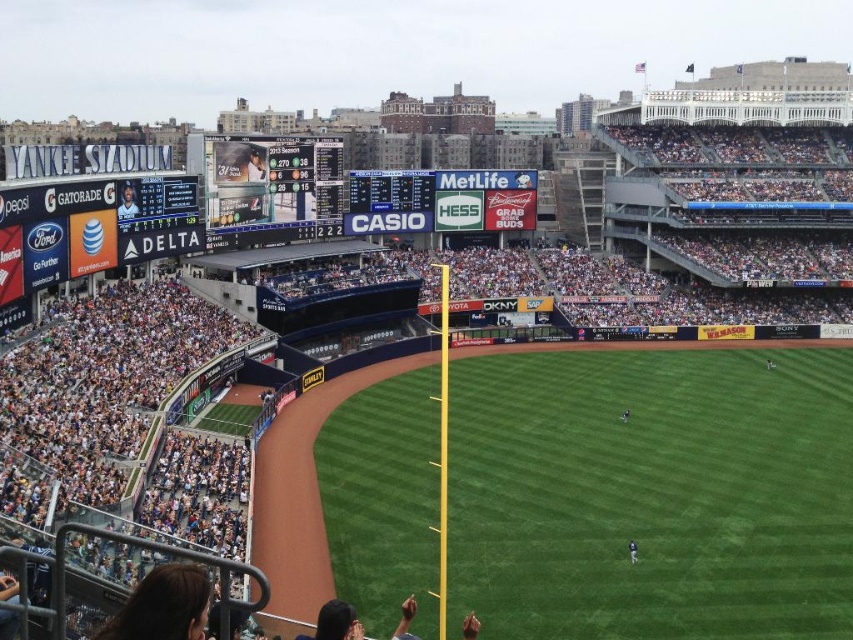
You are a photographer positioned at the center of the stadium field. You want to take a photo of the matte black jersey at upper left. In which general direction should you point your camera to capture it?

The matte black jersey at upper left is located at point 0.317 on the x and 0.150 on the y coordinate. Since the photographer is at the center, pointing the camera towards the upper left direction would capture the jersey.

You are a photographer positioned at the back of the stadium. You want to capture a photo that includes both the matte black jersey at upper left and the dark green jersey at center. Based on their positions, which jersey should you adjust your camera to focus on first to ensure both are in the frame?

Since the matte black jersey at upper left is to the left of the dark green jersey at center, you should first focus your camera on the matte black jersey at upper left to ensure it is positioned on the left side of the frame, allowing space for the dark green jersey at center to be included to its right.

You are a photographer at the stadium and want to capture both the blue plastic scoreboard at center and the dark blue uniform at center in a single shot. Since you can only focus on one object, which one should you choose to ensure it appears larger in the photo?

The blue plastic scoreboard at center is larger in size than the dark blue uniform at center, so focusing on the blue plastic scoreboard at center will make it appear larger in the photo.